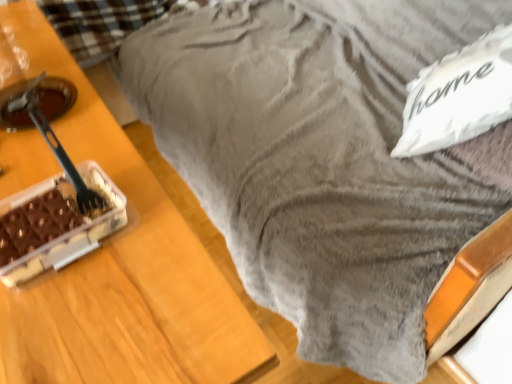
Locate an element on the screen. The height and width of the screenshot is (384, 512). free point to the right of chocolate matte cake at left is located at coordinates (164, 258).